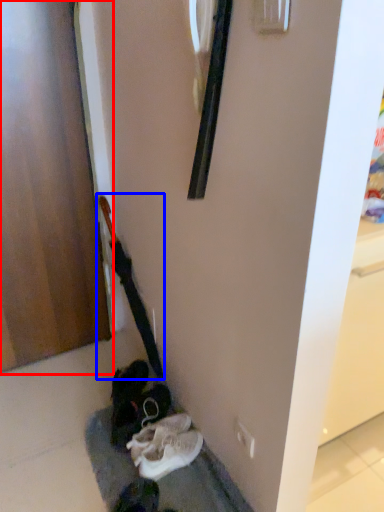
Question: Which of the following is the closest to the observer, door (highlighted by a red box) or guitar (highlighted by a blue box)?

Choices:
 (A) door
 (B) guitar

Answer: (A)